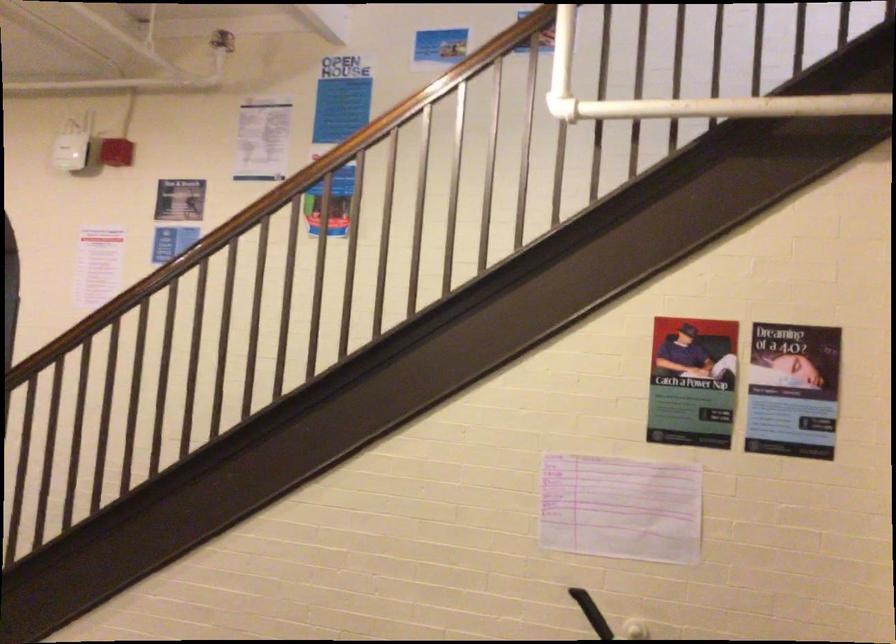
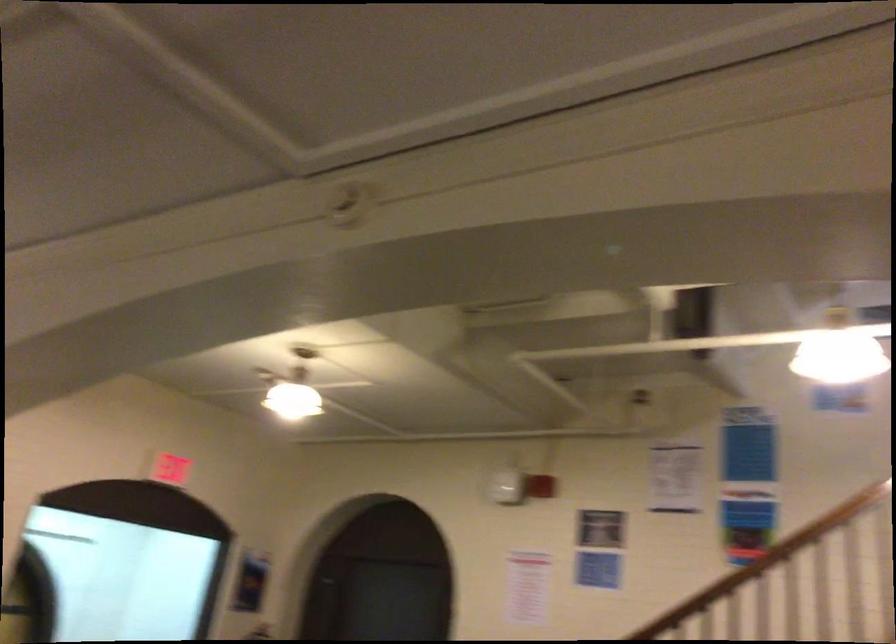
What movement of the cameraman would produce the second image?

The movement direction of the cameraman is left, backward.